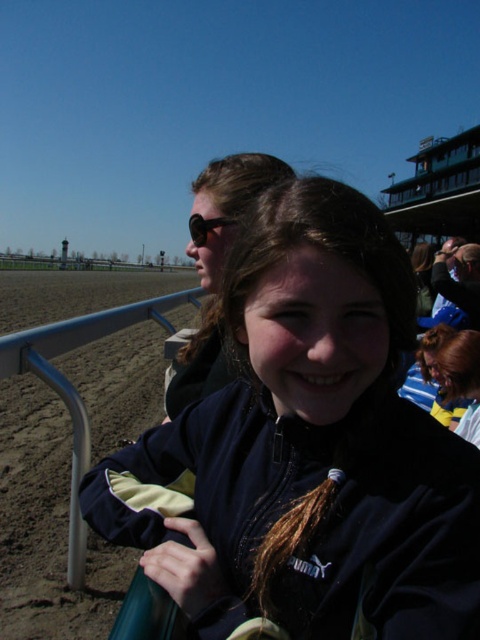
You are a photographer trying to capture both the navy blue jacket at center and the matte black jacket at center in the same frame. Based on their positions, which jacket should you focus on first to ensure both are in the shot?

The navy blue jacket at center is positioned under the matte black jacket at center, so you should focus on the matte black jacket at center first to ensure both are visible in the frame.

You are a photographer standing at the edge of the horse racing track. You notice the matte black jacket at center and the matte black sunglasses at upper center in your viewfinder. You want to take a photo where both objects are in focus. The camera you are using has a depth of field that can cover 3 feet. Can you capture both objects in focus without adjusting your camera settings?

The matte black jacket at center and matte black sunglasses at upper center are 3.43 feet apart. Since the depth of field can only cover 3 feet, the distance between them exceeds the camera settings. Therefore, you cannot capture both objects in focus without adjusting your camera settings.

What are the coordinates of the navy blue jacket at center?

The navy blue jacket at center is located at point [305,449].